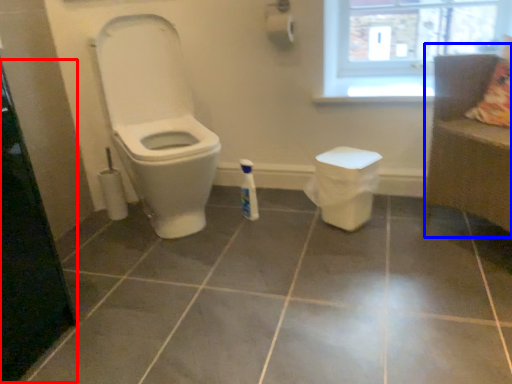
Question: Which of the following is the farthest to the observer, screen door (highlighted by a red box) or couch (highlighted by a blue box)?

Choices:
 (A) screen door
 (B) couch

Answer: (B)